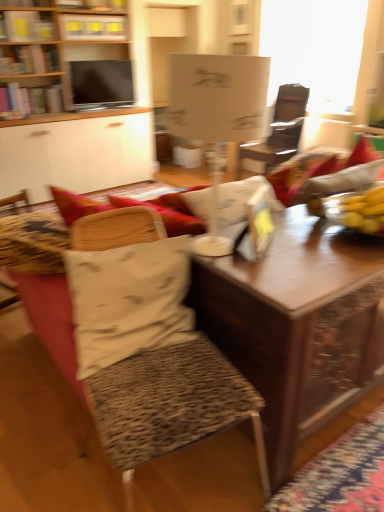
Question: Is matte black tv at upper left shorter than wooden desk at center?

Choices:
 (A) yes
 (B) no

Answer: (A)

Question: Is matte black tv at upper left beside wooden desk at center?

Choices:
 (A) no
 (B) yes

Answer: (A)

Question: Can you confirm if matte black tv at upper left is smaller than wooden desk at center?

Choices:
 (A) no
 (B) yes

Answer: (B)

Question: Does matte black tv at upper left have a greater width compared to wooden desk at center?

Choices:
 (A) no
 (B) yes

Answer: (A)

Question: Considering the relative positions of matte black tv at upper left and wooden desk at center in the image provided, is matte black tv at upper left to the left of wooden desk at center from the viewer's perspective?

Choices:
 (A) no
 (B) yes

Answer: (A)

Question: Would you say leopard print cushion at center is inside or outside matte black tv at upper left?

Choices:
 (A) inside
 (B) outside

Answer: (B)

Question: Looking at their shapes, would you say leopard print cushion at center is wider or thinner than matte black tv at upper left?

Choices:
 (A) wide
 (B) thin

Answer: (A)

Question: Would you say leopard print cushion at center is to the left or to the right of matte black tv at upper left in the picture?

Choices:
 (A) right
 (B) left

Answer: (A)

Question: Is point (142, 415) closer or farther from the camera than point (76, 81)?

Choices:
 (A) farther
 (B) closer

Answer: (B)

Question: From a real-world perspective, is wooden bookshelf at upper left positioned above or below white paper at upper left?

Choices:
 (A) above
 (B) below

Answer: (B)

Question: Visually, is wooden bookshelf at upper left positioned to the left or to the right of white paper at upper left?

Choices:
 (A) left
 (B) right

Answer: (B)

Question: Which is correct: wooden bookshelf at upper left is inside white paper at upper left, or outside of it?

Choices:
 (A) outside
 (B) inside

Answer: (A)

Question: Is point (94, 54) positioned closer to the camera than point (26, 29)?

Choices:
 (A) closer
 (B) farther

Answer: (B)

Question: Based on their positions, is wooden table at center located to the left or right of wooden bookshelf at upper center?

Choices:
 (A) right
 (B) left

Answer: (A)

Question: From their relative heights in the image, would you say wooden table at center is taller or shorter than wooden bookshelf at upper center?

Choices:
 (A) short
 (B) tall

Answer: (B)